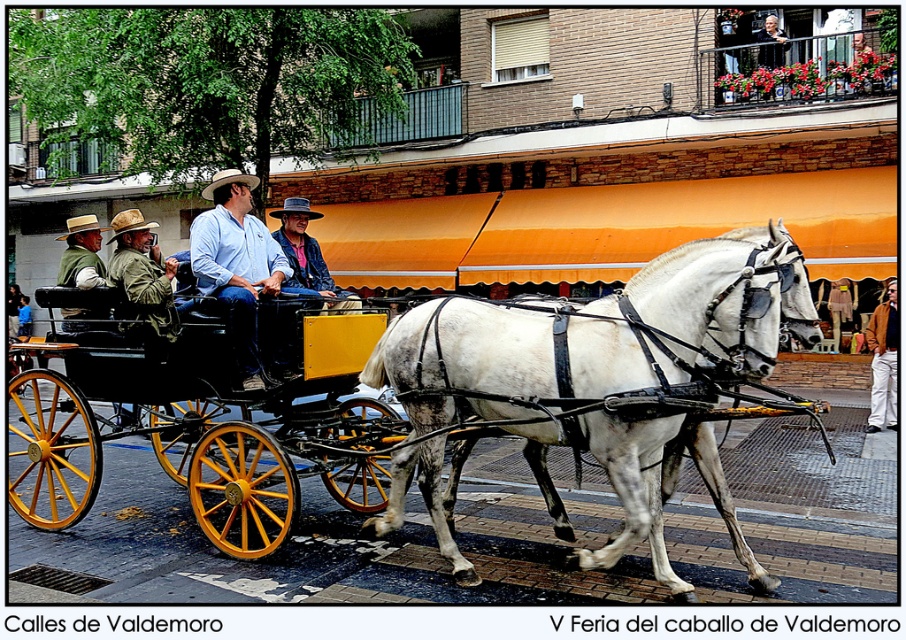
Question: Does wooden wagon at center appear over green fabric jacket at left?

Choices:
 (A) no
 (B) yes

Answer: (A)

Question: Which point appears farthest from the camera in this image?

Choices:
 (A) (255, 246)
 (B) (151, 221)
 (C) (323, 214)
 (D) (895, 323)

Answer: (C)

Question: Can you confirm if green fabric jacket at left is bigger than brown leather jacket at lower right?

Choices:
 (A) no
 (B) yes

Answer: (A)

Question: Based on their relative distances, which object is nearer to the brown straw cowboy hat at upper center?

Choices:
 (A) rustic straw cowboy hat at center
 (B) wooden wagon at center
 (C) light blue shirt at center

Answer: (C)

Question: Estimate the real-world distances between objects in this image. Which object is farther from the denim jacket at center?

Choices:
 (A) brown straw cowboy hat at upper left
 (B) white speckled harness at center

Answer: (A)

Question: Does white speckled harness at center have a greater width compared to green fabric jacket at left?

Choices:
 (A) yes
 (B) no

Answer: (A)